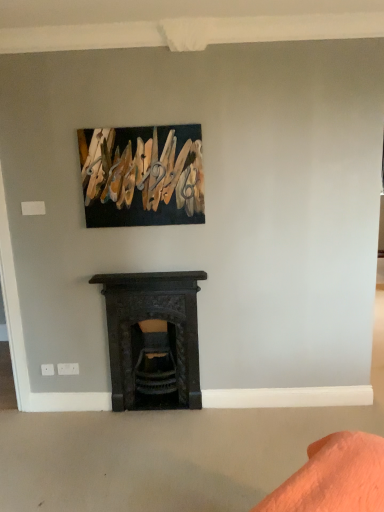
Identify the location of empty space that is ontop of wooden clothespins at upper center. (143, 129).